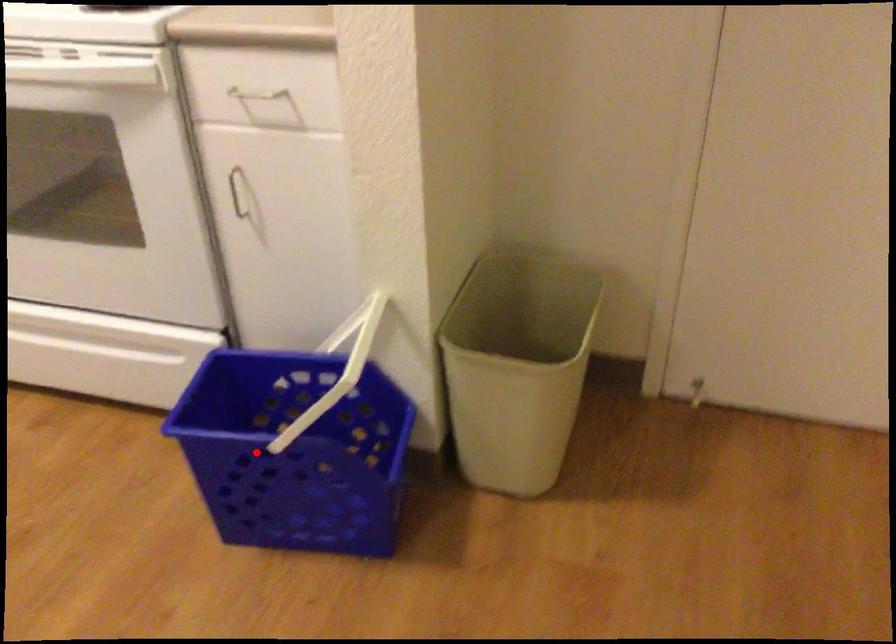
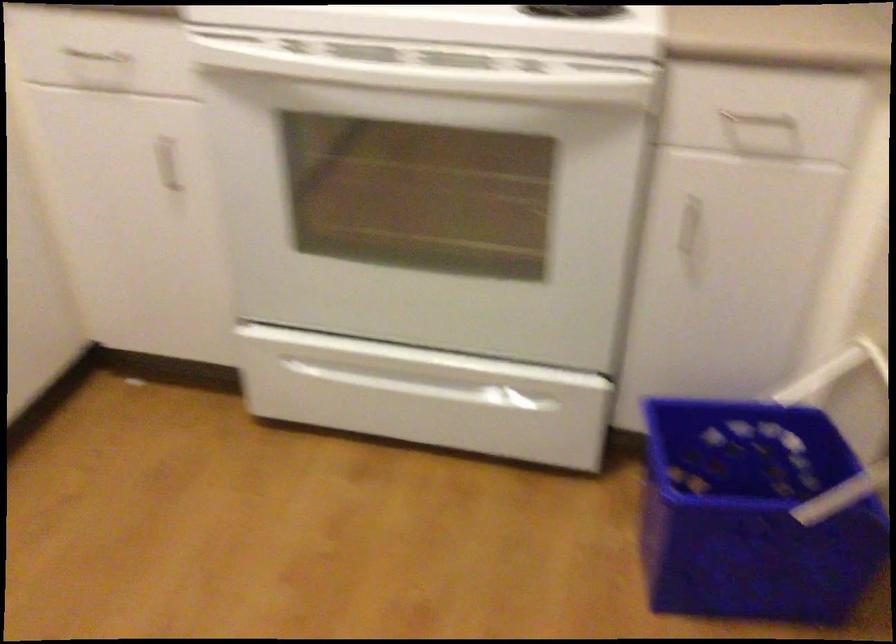
Find the pixel in the second image that matches the highlighted location in the first image.

(752, 514)